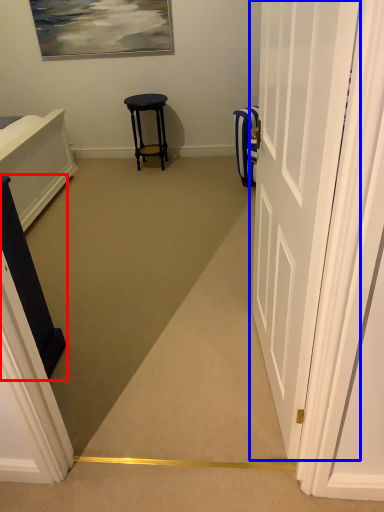
Question: Among these objects, which one is farthest to the camera, furniture (highlighted by a red box) or door (highlighted by a blue box)?

Choices:
 (A) furniture
 (B) door

Answer: (A)